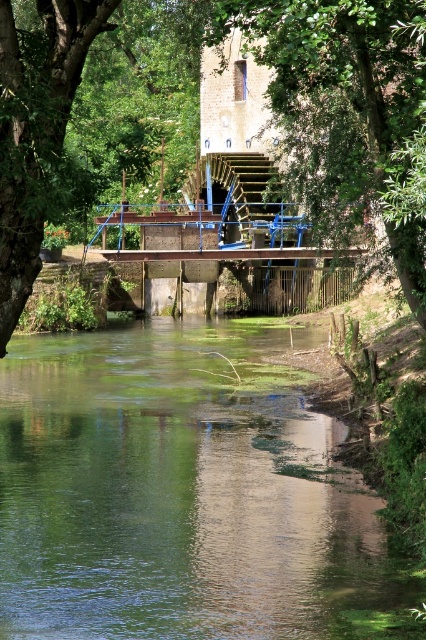
Who is more distant from viewer, (226, 369) or (40, 230)?

The point (226, 369) is more distant.

Consider the image. Who is positioned more to the right, green reflective water at center or green leafy tree at upper center?

From the viewer's perspective, green leafy tree at upper center appears more on the right side.

Image resolution: width=426 pixels, height=640 pixels. In order to click on green reflective water at center in this screenshot , I will do `click(178, 490)`.

Where is `green reflective water at center`? The height and width of the screenshot is (640, 426). green reflective water at center is located at coordinates (178, 490).

Is point (19, 378) more distant than point (265, 60)?

Yes, point (19, 378) is behind point (265, 60).

Between point (261, 364) and point (351, 196), which one is positioned in front?

Positioned in front is point (351, 196).

Find the location of a particular element. Image resolution: width=426 pixels, height=640 pixels. green reflective water at center is located at coordinates (178, 490).

Is point (270, 6) closer to viewer compared to point (351, 172)?

Yes, point (270, 6) is in front of point (351, 172).

Can you confirm if green leafy tree at upper center is shorter than green leafy tree at center?

Yes.

Which is behind, point (55, 161) or point (307, 141)?

Positioned behind is point (307, 141).

Where is `green leafy tree at upper center`? green leafy tree at upper center is located at coordinates (333, 65).